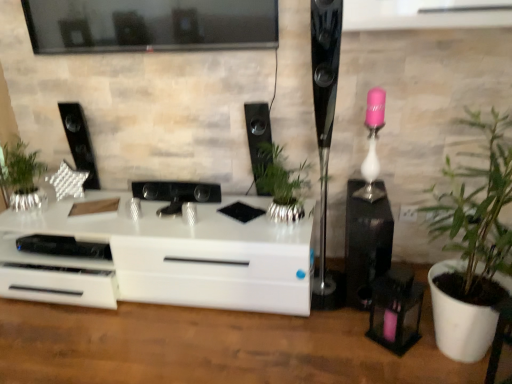
Identify the location of vacant region to the right of silver metallic plant at left, which ranks as the 1th houseplant in left-to-right order. (74, 210).